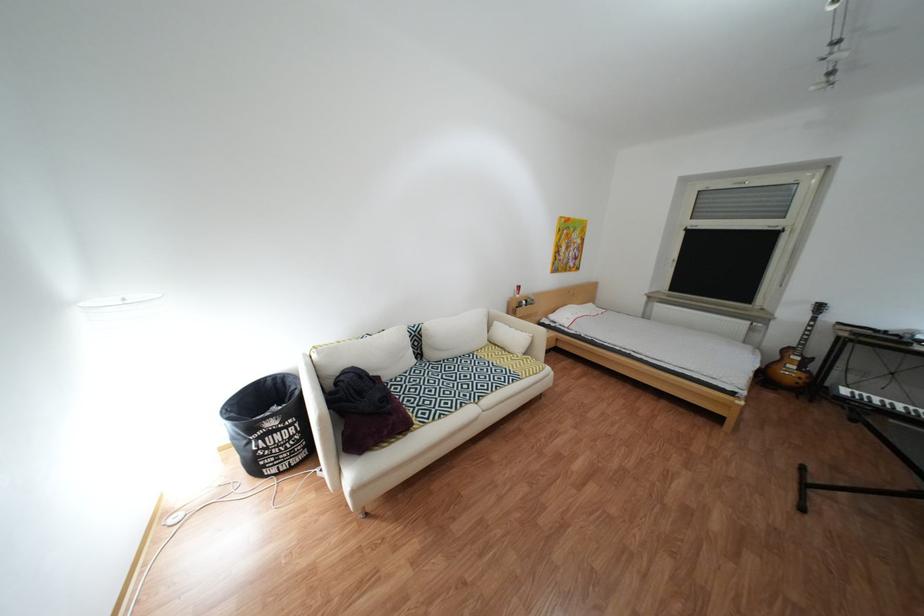
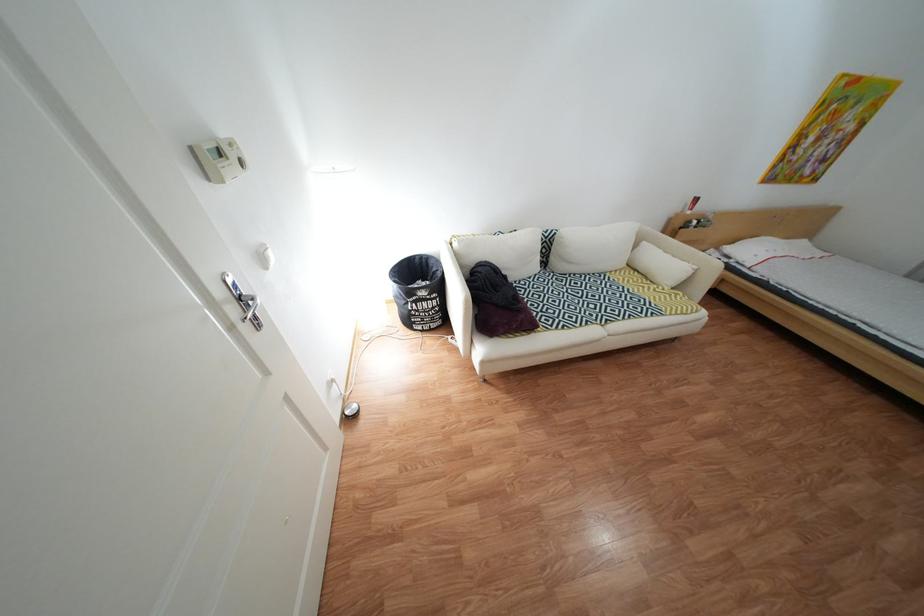
Find the pixel in the second image that matches point (430, 331) in the first image.

(562, 236)